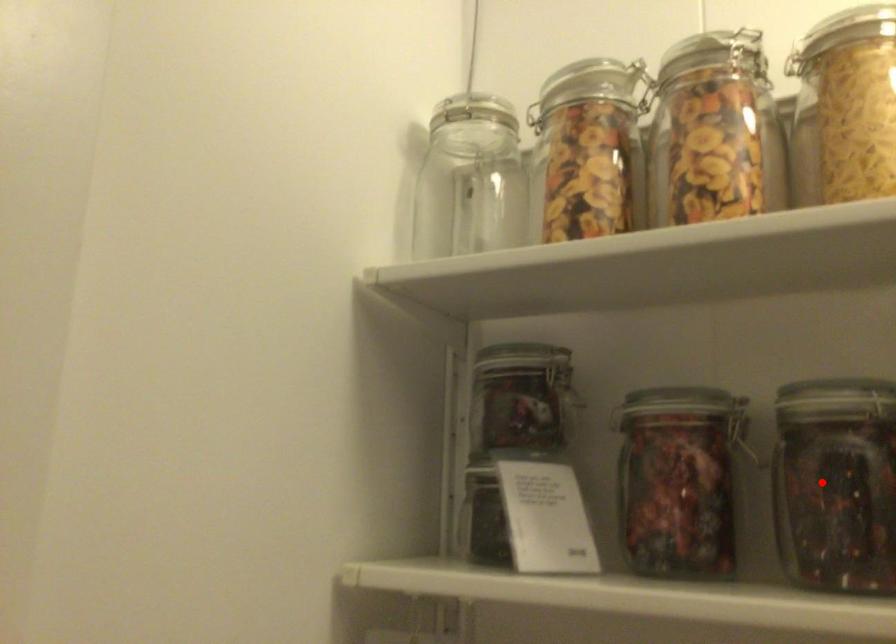
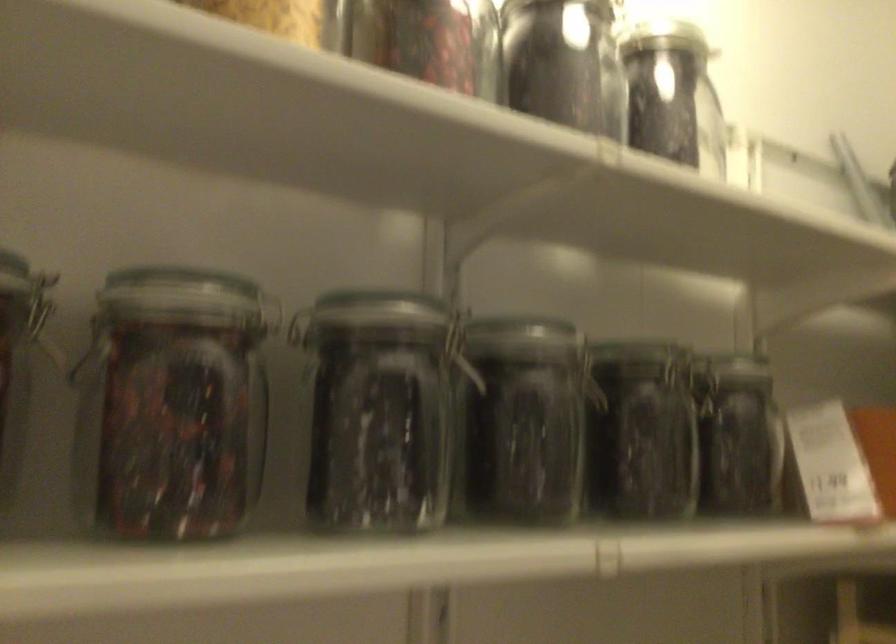
The point at the highlighted location is marked in the first image. Where is the corresponding point in the second image?

(170, 406)